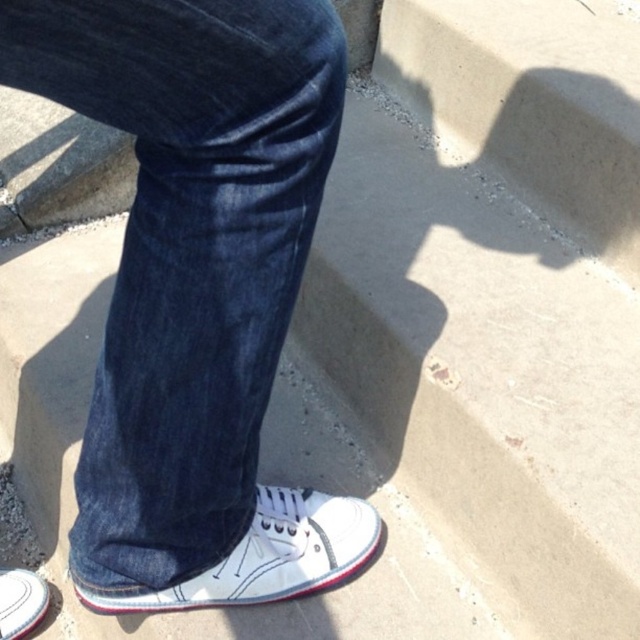
You are designing a shoe rack and need to know the width of the white canvas shoe at lower center and the white canvas shoe at lower left. Can you determine which one is wider?

The white canvas shoe at lower center might be wider than white canvas shoe at lower left according to the description.

You are a tailor measuring clothing for a customer. You notice the dark blue denim jeans at center and the white canvas shoe at lower left in the image. Which item has a larger size?

The dark blue denim jeans at center has a larger size compared to the white canvas shoe at lower left.